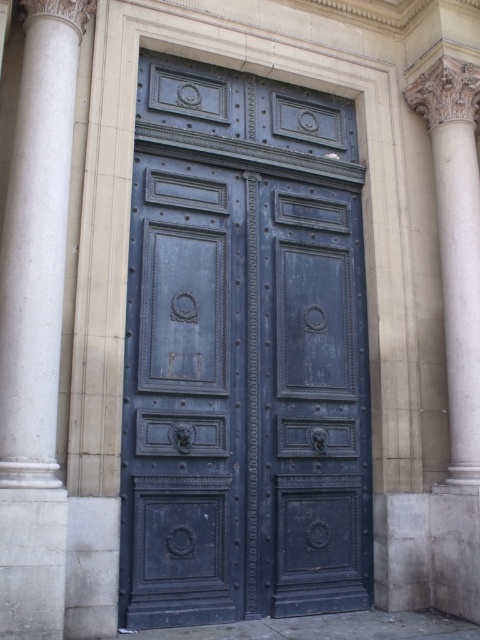
You are an architect assessing the symmetry of the building facade. The dark blue wood door at center and the white marble column at left are part of the design. Which object is shorter in height?

The dark blue wood door at center is shorter in height compared to the white marble column at left according to the description.

You are an architect designing a new building and want to ensure the dark blue wood door at center and the white marble column at left are proportionate. Based on the image, which object should you scale down to maintain proper proportions?

The dark blue wood door at center is larger than the white marble column at left, so you should scale down the dark blue wood door at center to match the size of the white marble column at left for proper proportions.

You are an architect standing 1.5 meters away from a wall. You want to place a decorative statue in front of the dark blue wood door at center. The statue requires a space of 6 meters between it and the door to ensure proper visibility. Is this possible?

The dark blue wood door at center is 6.55 meters from viewer. Since the statue needs to be placed 6 meters away from the door, and you are already 1.5 meters away from the wall, the total distance from the statue to the door would be 1.5 meters plus the distance from the statue to the wall. However, since the door is 6.55 meters away from the viewer, placing the statue 6 meters away from the door would require the statue to be placed 0.55 meters behind the viewer, which is not possible. Therefore, it is not